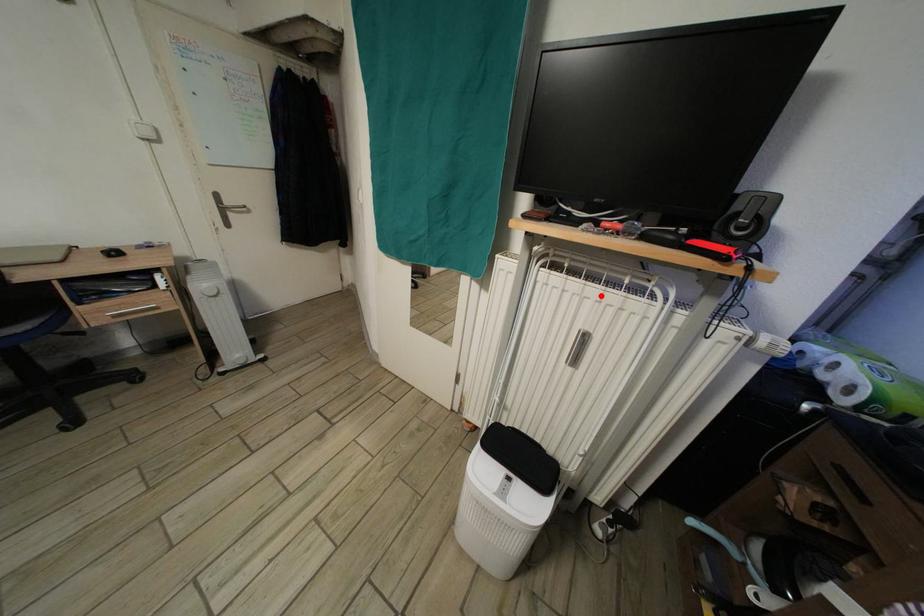
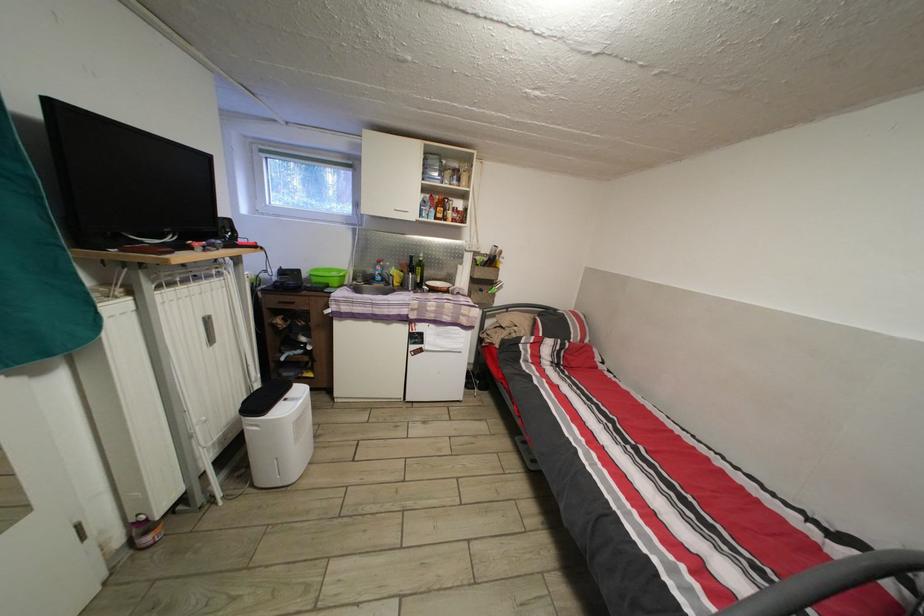
Find the pixel in the second image that matches the highlighted location in the first image.

(201, 294)